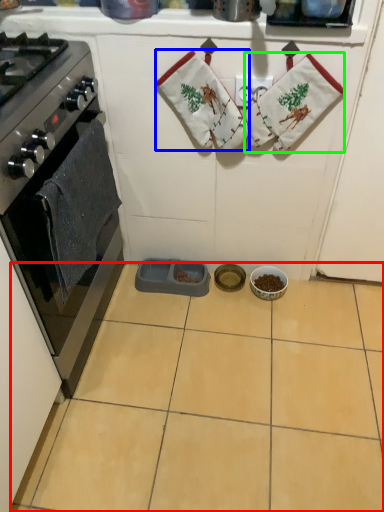
Question: Which object is the closest to the ceramic tile (highlighted by a red box)? Choose among these: hand towel (highlighted by a blue box) or material (highlighted by a green box).

Choices:
 (A) hand towel
 (B) material

Answer: (A)